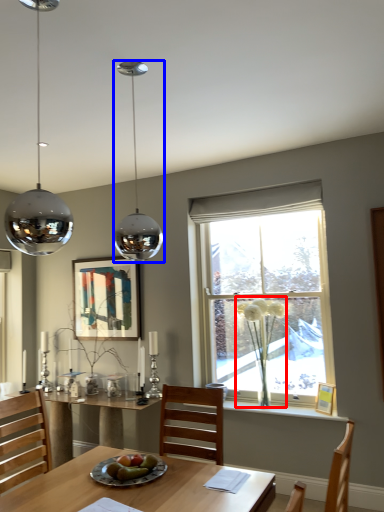
Question: Which object appears closest to the camera in this image, flower (highlighted by a red box) or lamp (highlighted by a blue box)?

Choices:
 (A) flower
 (B) lamp

Answer: (B)